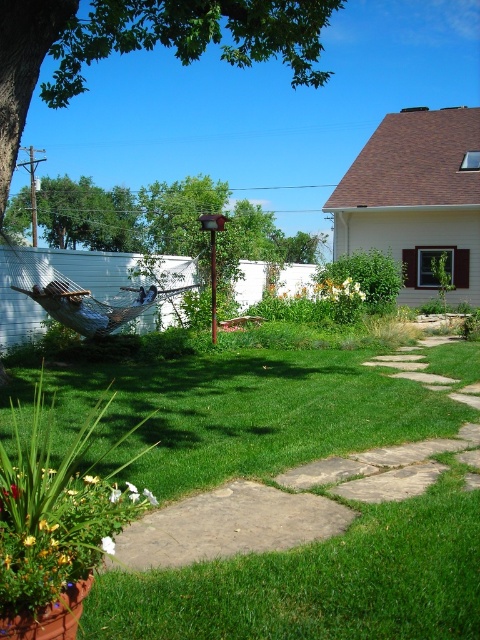
You are planning to hang a bird feeder between the green leafy tree at upper left and the blue fabric hammock at center. Based on their widths, which object should you place the bird feeder closer to?

The green leafy tree at upper left might be wider than the blue fabric hammock at center, so you should place the bird feeder closer to the blue fabric hammock at center to avoid blocking too much sunlight.

You are planning to install a new garden light between the green leafy tree at upper left and the blue fabric hammock at center. Based on their positions, which object should the light be closer to?

The green leafy tree at upper left is positioned on the right side of blue fabric hammock at center, so the light should be placed closer to the blue fabric hammock at center to be between them.